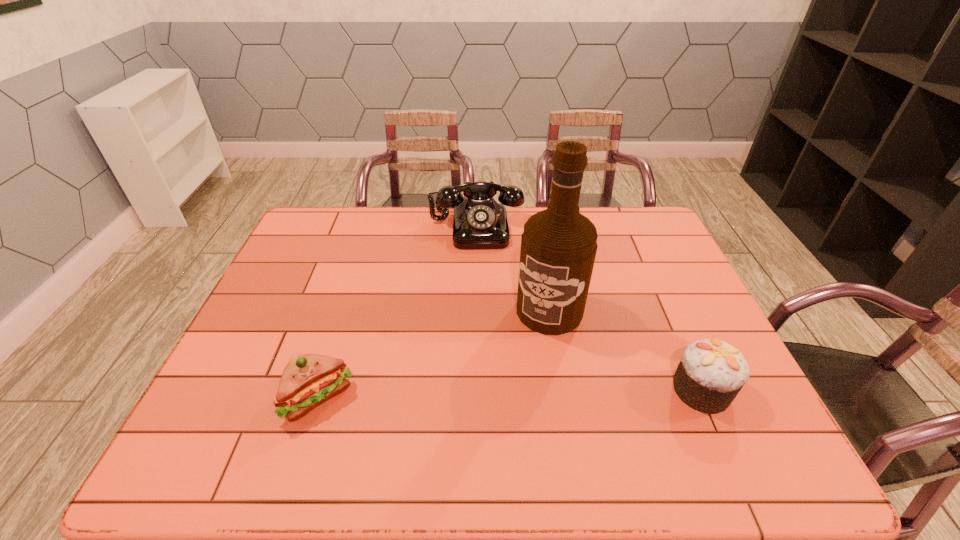
The image size is (960, 540). Find the location of `free spot between the leftmost object and the telephone`. free spot between the leftmost object and the telephone is located at coordinates (397, 313).

Locate an element on the screen. object that is the second closest one to the tallest object is located at coordinates (711, 373).

Locate an element on the screen. The height and width of the screenshot is (540, 960). object that is the closest to the telephone is located at coordinates (558, 246).

Image resolution: width=960 pixels, height=540 pixels. I want to click on vacant position in the image that satisfies the following two spatial constraints: 1. on the back side of the cupcake; 2. on the right side of the leftmost object, so click(321, 390).